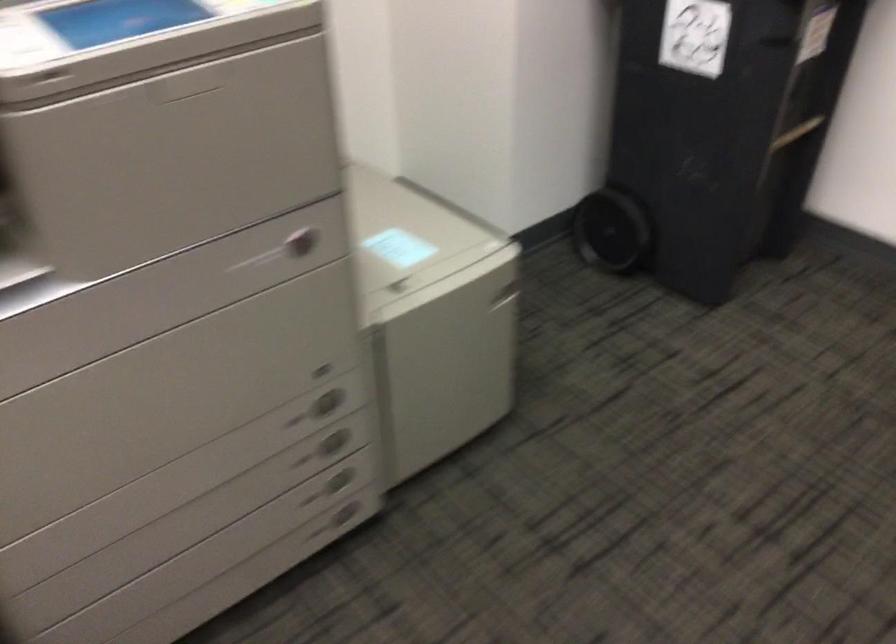
Where would you pull the recessed panel handle? Please return your answer as a coordinate pair (x, y).

(300, 242)